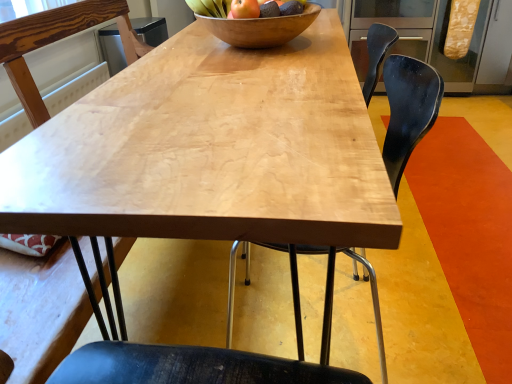
The width and height of the screenshot is (512, 384). I want to click on spots to the right of black plastic chair at center, which is counted as the third chair, starting from the left, so click(x=436, y=305).